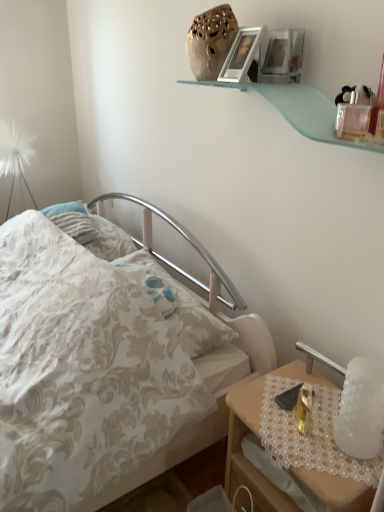
Question: Is clear plastic perfume bottle at upper right in front of or behind white floral fabric bed at center in the image?

Choices:
 (A) front
 (B) behind

Answer: (B)

Question: From a real-world perspective, is clear plastic perfume bottle at upper right above or below white floral fabric bed at center?

Choices:
 (A) below
 (B) above

Answer: (B)

Question: Based on their relative distances, which object is farther from the matte silver picture frame at upper center?

Choices:
 (A) wooden nightstand at lower right
 (B) white frosted glass bedside lamp at right
 (C) white floral fabric bed at center
 (D) clear plastic perfume bottle at upper right

Answer: (A)

Question: Estimate the real-world distances between objects in this image. Which object is farther from the matte silver picture frame at upper center?

Choices:
 (A) white frosted glass bedside lamp at right
 (B) white floral fabric bed at center
 (C) wooden nightstand at lower right
 (D) clear plastic perfume bottle at upper right

Answer: (C)